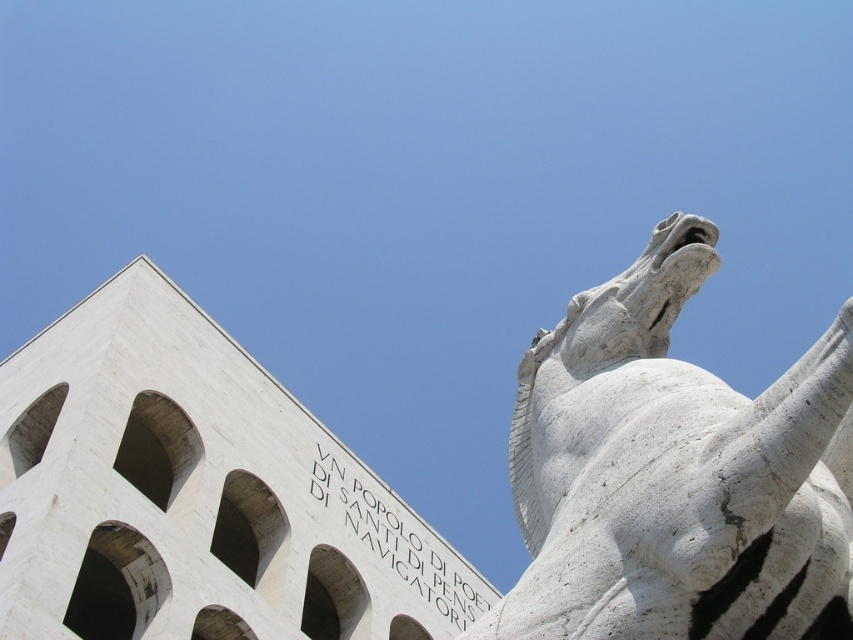
Question: Which of the following is the closest to the observer?

Choices:
 (A) white stone text at upper center
 (B) white marble horse at upper right

Answer: (B)

Question: Where is white marble horse at upper right located in relation to white stone text at upper center in the image?

Choices:
 (A) right
 (B) left

Answer: (A)

Question: In this image, where is white marble horse at upper right located relative to white stone text at upper center?

Choices:
 (A) below
 (B) above

Answer: (B)

Question: Which object is farther from the camera taking this photo?

Choices:
 (A) white stone text at upper center
 (B) white marble horse at upper right

Answer: (A)

Question: Does white marble horse at upper right appear over white stone text at upper center?

Choices:
 (A) yes
 (B) no

Answer: (A)